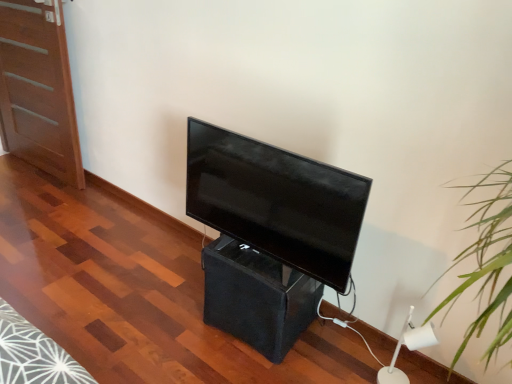
You are a GUI agent. You are given a task and a screenshot of the screen. Output one action in this format:
    pyautogui.click(x=<x>, y=<y>)
    Task: Click on the free space to the left of black fabric speaker at center
    
    Given the screenshot: What is the action you would take?
    pyautogui.click(x=176, y=307)